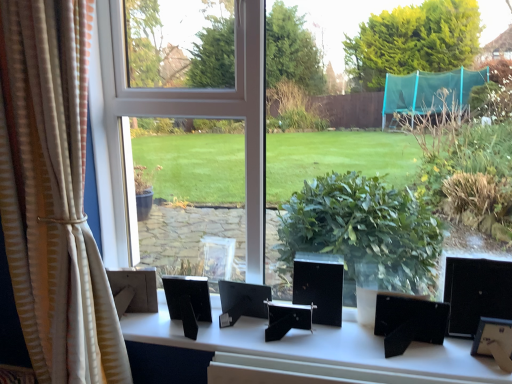
Question: In terms of width, does black plastic picture frames at center look wider or thinner when compared to beige striped curtain at left?

Choices:
 (A) wide
 (B) thin

Answer: (A)

Question: Looking at the image, does black plastic picture frames at center seem bigger or smaller compared to beige striped curtain at left?

Choices:
 (A) big
 (B) small

Answer: (B)

Question: Which is farther from the black plastic picture frames at center?

Choices:
 (A) beige striped curtain at left
 (B) transparent glass window at center

Answer: (B)

Question: Which of these objects is positioned farthest from the black plastic picture frames at center?

Choices:
 (A) transparent glass window at center
 (B) beige striped curtain at left

Answer: (A)